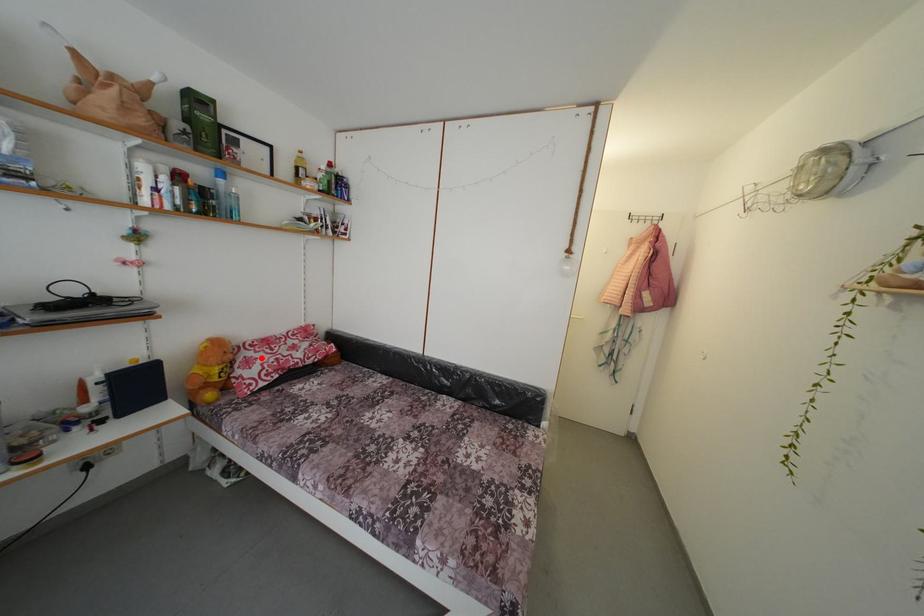
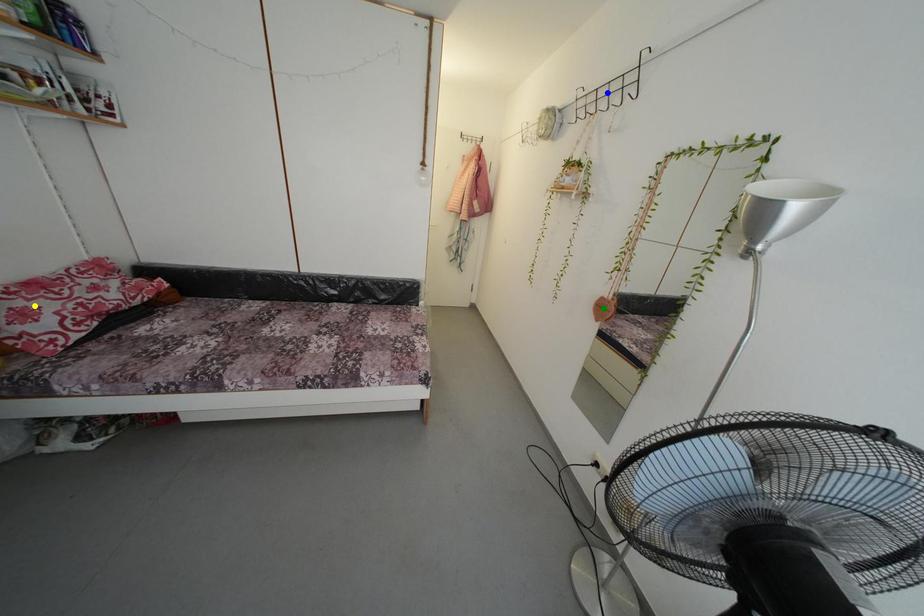
Question: I am providing you with two images of the same scene from different viewpoints. A red point is marked on the first image. You are given multiple points on the second image. Can you choose the point in image 2 that corresponds to the point in image 1?

Choices:
 (A) yellow point
 (B) green point
 (C) blue point

Answer: (A)